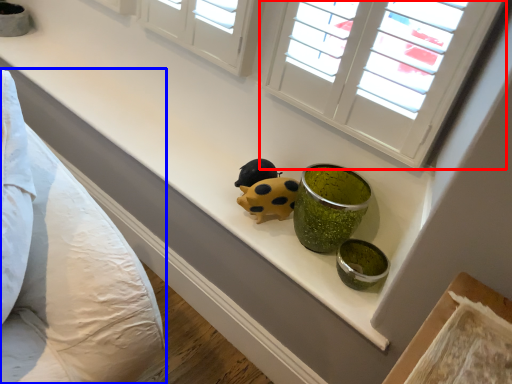
Question: Which object appears farthest to the camera in this image, window (highlighted by a red box) or bedding (highlighted by a blue box)?

Choices:
 (A) window
 (B) bedding

Answer: (A)